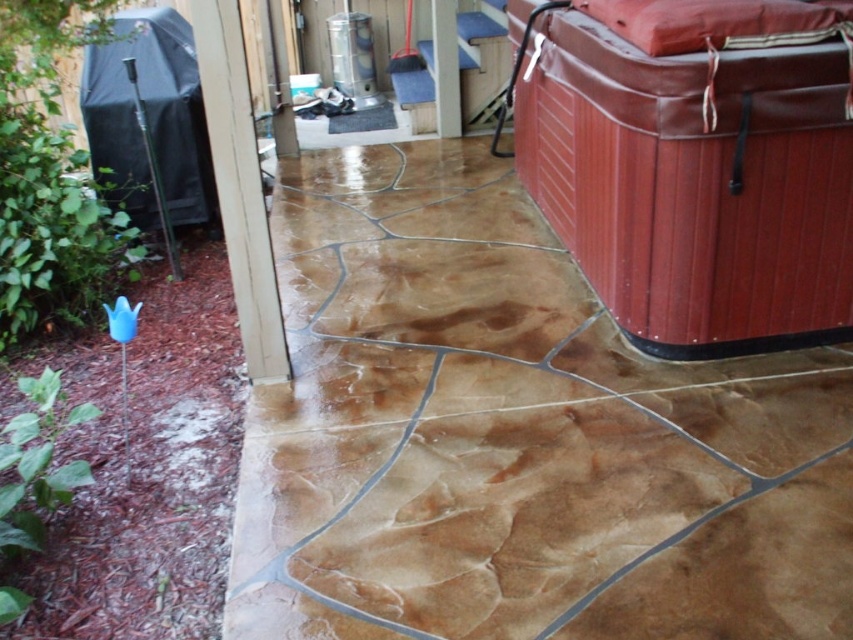
You are planning to place a new potted plant on the brown textured concrete at center. However, there is a brown textured hot tub at right nearby. Based on their positions, will the hot tub block sunlight reaching the concrete area where you want to place the plant?

The brown textured concrete at center is positioned under the brown textured hot tub at right, so the hot tub will block sunlight from reaching the concrete area where the plant is placed.

You are standing on the brown textured concrete at center and want to move to the brown textured hot tub at right. Which direction should you walk to reach it?

You should walk to the right to reach the brown textured hot tub at right since the brown textured concrete at center is to the left of it.

You are planning to place a new bench on the patio. The bench is 1.5 meters long. The brown textured hot tub at right and the brown textured tile at center are already there. Which area can accommodate the bench without overlapping either object?

The brown textured hot tub at right has a larger size compared to brown textured tile at center. Therefore, the brown textured tile at center has more space around it, so placing the bench near the brown textured tile at center would be better to avoid overlapping.